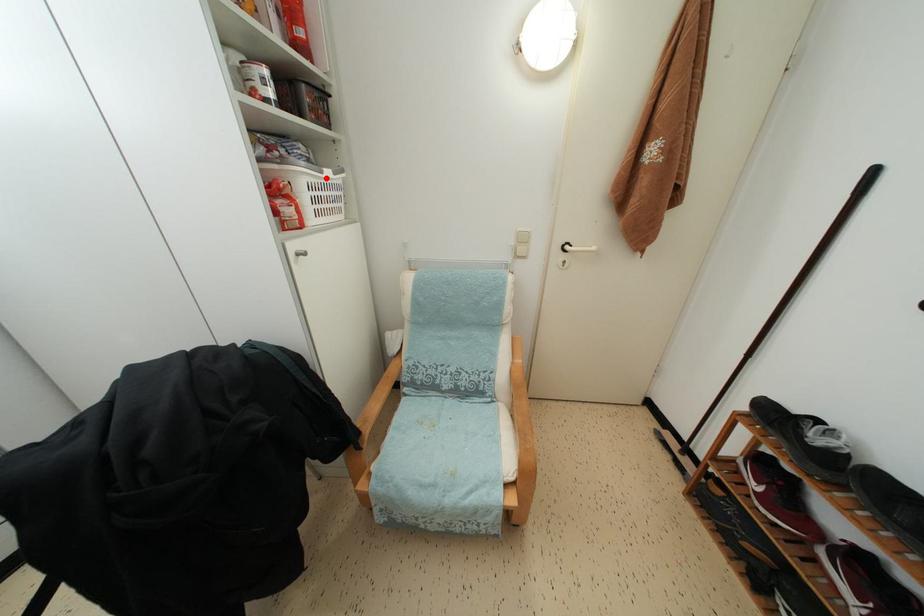
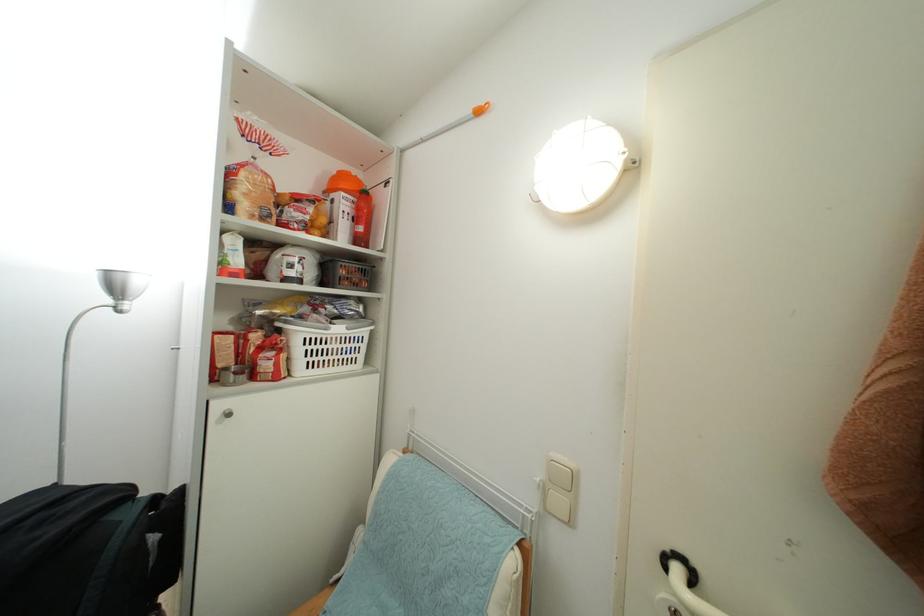
Where in the second image is the point corresponding to the highlighted location from the first image?

(331, 334)